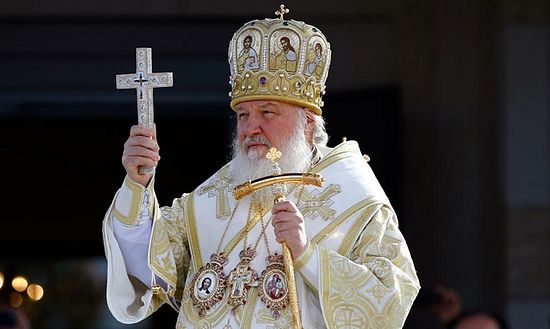
Where is `yellow light`? This screenshot has height=329, width=550. yellow light is located at coordinates (40, 296).